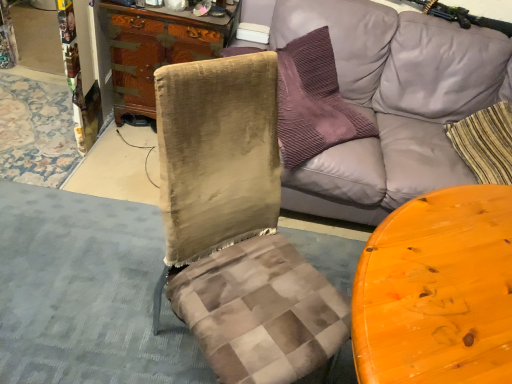
Question: From the image's perspective, relative to wooden cabinet at center, is gray fabric couch at upper right above or below?

Choices:
 (A) above
 (B) below

Answer: (B)

Question: From a real-world perspective, is gray fabric couch at upper right above or below wooden cabinet at center?

Choices:
 (A) above
 (B) below

Answer: (A)

Question: Is gray fabric couch at upper right inside the boundaries of wooden cabinet at center, or outside?

Choices:
 (A) inside
 (B) outside

Answer: (B)

Question: Based on their sizes in the image, would you say wooden cabinet at center is bigger or smaller than gray fabric couch at upper right?

Choices:
 (A) big
 (B) small

Answer: (B)

Question: Is point (220, 36) closer or farther from the camera than point (323, 23)?

Choices:
 (A) closer
 (B) farther

Answer: (B)

Question: Considering their positions, is wooden cabinet at center located in front of or behind gray fabric couch at upper right?

Choices:
 (A) front
 (B) behind

Answer: (B)

Question: Is wooden cabinet at center situated inside gray fabric couch at upper right or outside?

Choices:
 (A) inside
 (B) outside

Answer: (B)